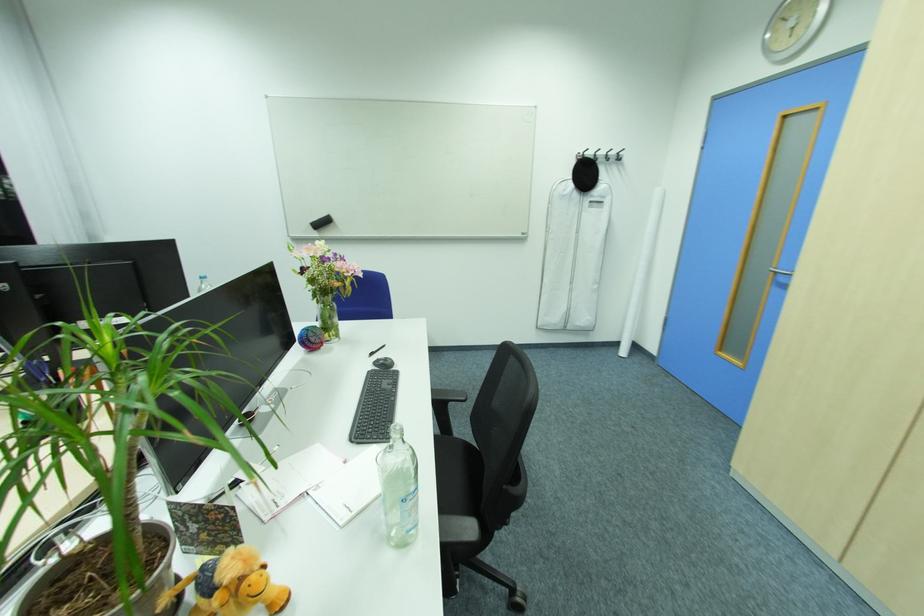
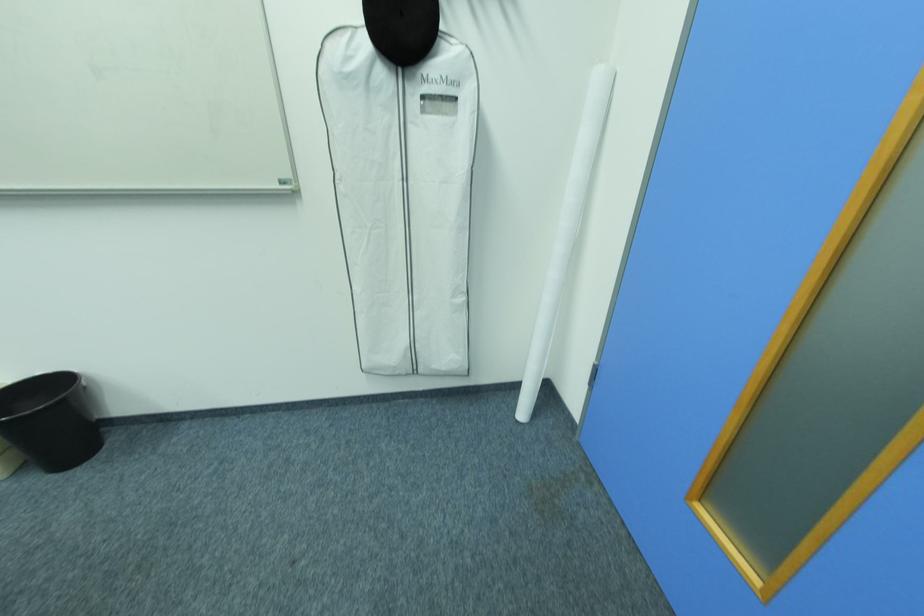
Locate, in the second image, the point that corresponds to point (578, 283) in the first image.

(416, 292)